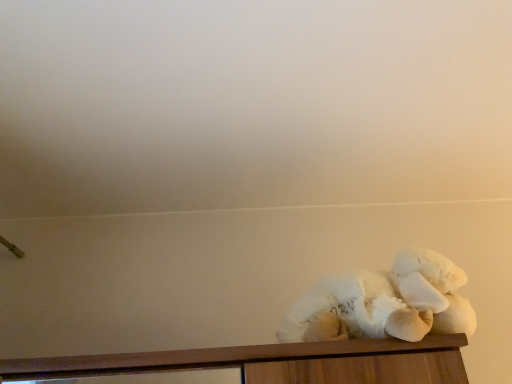
This screenshot has width=512, height=384. Describe the element at coordinates (384, 303) in the screenshot. I see `white fluffy teddy bear at right` at that location.

Measure the distance between point (x=418, y=258) and camera.

Point (x=418, y=258) is 34.45 inches from camera.

Find the location of a particular element. white fluffy teddy bear at right is located at coordinates (384, 303).

What do you see at coordinates (276, 362) in the screenshot? I see `wooden cabinet at lower right` at bounding box center [276, 362].

Locate an element on the screen. The height and width of the screenshot is (384, 512). wooden cabinet at lower right is located at coordinates (276, 362).

Find the location of a particular element. white fluffy teddy bear at right is located at coordinates (384, 303).

Is white fluffy teddy bear at right to the left of wooden cabinet at lower right from the viewer's perspective?

Incorrect, white fluffy teddy bear at right is not on the left side of wooden cabinet at lower right.

Considering the positions of objects white fluffy teddy bear at right and wooden cabinet at lower right in the image provided, who is in front, white fluffy teddy bear at right or wooden cabinet at lower right?

wooden cabinet at lower right is closer to the camera.

Is point (301, 313) closer to viewer compared to point (342, 353)?

No.

Consider the image. From the image's perspective, is white fluffy teddy bear at right located beneath wooden cabinet at lower right?

No.

From a real-world perspective, between white fluffy teddy bear at right and wooden cabinet at lower right, who is vertically higher?

white fluffy teddy bear at right is physically above.

Which of these two, white fluffy teddy bear at right or wooden cabinet at lower right, is thinner?

white fluffy teddy bear at right.

Can you confirm if white fluffy teddy bear at right is taller than wooden cabinet at lower right?

Yes, white fluffy teddy bear at right is taller than wooden cabinet at lower right.

Based on their sizes in the image, would you say white fluffy teddy bear at right is bigger or smaller than wooden cabinet at lower right?

In the image, white fluffy teddy bear at right appears to be smaller than wooden cabinet at lower right.

Choose the correct answer: Is white fluffy teddy bear at right inside wooden cabinet at lower right or outside it?

white fluffy teddy bear at right is outside wooden cabinet at lower right.

Is white fluffy teddy bear at right directly adjacent to wooden cabinet at lower right?

white fluffy teddy bear at right is not next to wooden cabinet at lower right, and they're not touching.

Is white fluffy teddy bear at right aimed at wooden cabinet at lower right?

No.

What's the angular difference between white fluffy teddy bear at right and wooden cabinet at lower right's facing directions?

5.77 degrees.

The height and width of the screenshot is (384, 512). I want to click on teddy bear on the right of wooden cabinet at lower right, so click(x=384, y=303).

Does wooden cabinet at lower right appear on the right side of white fluffy teddy bear at right?

No.

Is the position of wooden cabinet at lower right more distant than that of white fluffy teddy bear at right?

No, it is not.

Is point (283, 351) positioned in front of point (342, 312)?

That is True.

From the image's perspective, is wooden cabinet at lower right positioned above or below white fluffy teddy bear at right?

Clearly, from the image's perspective, wooden cabinet at lower right is below white fluffy teddy bear at right.

From a real-world perspective, is wooden cabinet at lower right physically below white fluffy teddy bear at right?

Yes, from a real-world perspective, wooden cabinet at lower right is under white fluffy teddy bear at right.

Which object is wider, wooden cabinet at lower right or white fluffy teddy bear at right?

wooden cabinet at lower right.

Between wooden cabinet at lower right and white fluffy teddy bear at right, which one has less height?

wooden cabinet at lower right.

Which of these two, wooden cabinet at lower right or white fluffy teddy bear at right, is smaller?

white fluffy teddy bear at right.

Which is correct: wooden cabinet at lower right is inside white fluffy teddy bear at right, or outside of it?

wooden cabinet at lower right is outside white fluffy teddy bear at right.

Is wooden cabinet at lower right positioned far away from white fluffy teddy bear at right?

No, there isn't a large distance between wooden cabinet at lower right and white fluffy teddy bear at right.

Is wooden cabinet at lower right oriented towards white fluffy teddy bear at right?

No, wooden cabinet at lower right is not oriented towards white fluffy teddy bear at right.

How much distance is there between wooden cabinet at lower right and white fluffy teddy bear at right?

The distance of wooden cabinet at lower right from white fluffy teddy bear at right is 4.42 inches.

This screenshot has width=512, height=384. Identify the location of teddy bear above the wooden cabinet at lower right (from the image's perspective). (384, 303).

In order to click on furniture that appears in front of the white fluffy teddy bear at right in this screenshot , I will do `click(276, 362)`.

The width and height of the screenshot is (512, 384). In order to click on teddy bear behind the wooden cabinet at lower right in this screenshot , I will do `click(384, 303)`.